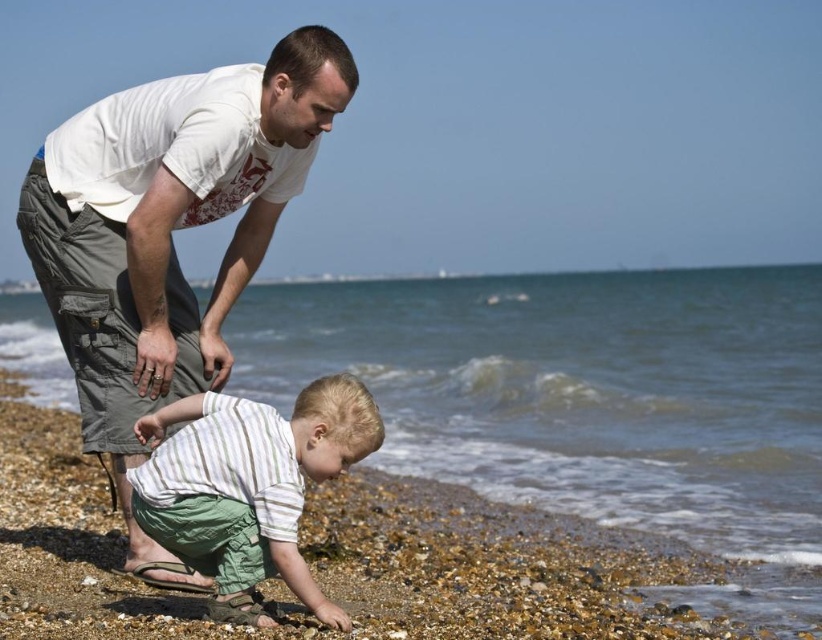
Question: Does smooth pebbles at lower center appear on the right side of striped cotton shirt at lower center?

Choices:
 (A) yes
 (B) no

Answer: (B)

Question: Estimate the real-world distances between objects in this image. Which object is farther from the smooth pebbles at lower center?

Choices:
 (A) white cotton t-shirt at upper left
 (B) striped cotton shirt at lower center

Answer: (B)

Question: Which object is positioned farthest from the white cotton t-shirt at upper left?

Choices:
 (A) striped cotton shirt at lower center
 (B) smooth pebbles at lower center

Answer: (B)

Question: Among these points, which one is nearest to the camera?

Choices:
 (A) (x=47, y=621)
 (B) (x=165, y=92)

Answer: (A)

Question: From the image, what is the correct spatial relationship of white cotton t-shirt at upper left in relation to striped cotton shirt at lower center?

Choices:
 (A) left
 (B) right

Answer: (A)

Question: Does white cotton t-shirt at upper left lie in front of striped cotton shirt at lower center?

Choices:
 (A) yes
 (B) no

Answer: (B)